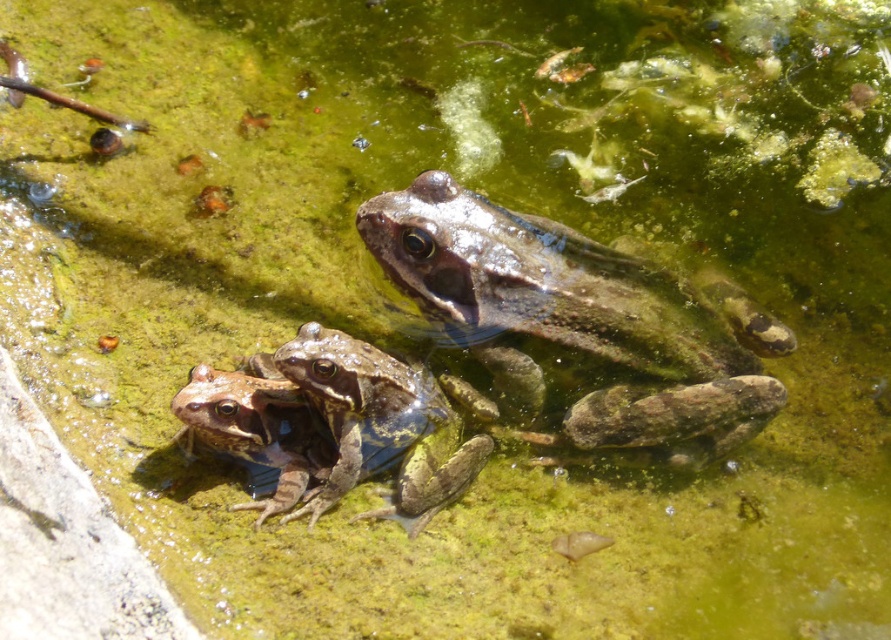
Based on the photo, you are standing 2 meters away from the point at coordinates point (713, 433). Can you reach the point without moving closer?

The distance of point (713, 433) from viewer is 1.70 meters. Since you are currently 2 meters away, you need to move 0.3 meters closer to reach it.

You are a researcher studying frog habitats. You need to locate the exact point at coordinates point (582,321) in the image. Which frog is this point located on?

The point (582,321) is located on the camouflage skin frog at center.